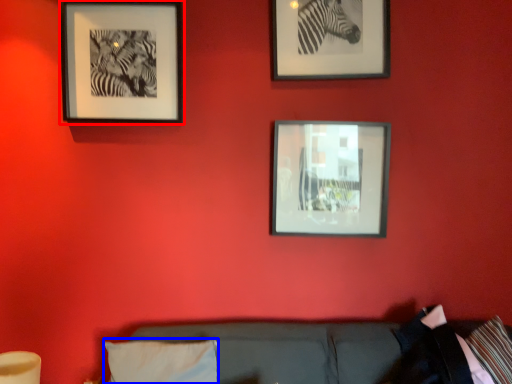
Question: Among these objects, which one is nearest to the camera, picture frame (highlighted by a red box) or pillow (highlighted by a blue box)?

Choices:
 (A) picture frame
 (B) pillow

Answer: (B)